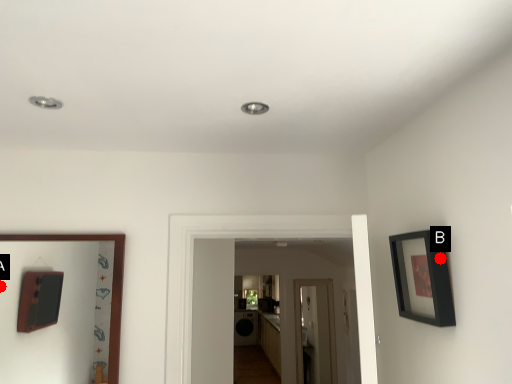
Question: Two points are circled on the image, labeled by A and B beside each circle. Which point is further to the camera?

Choices:
 (A) A is further
 (B) B is further

Answer: (A)